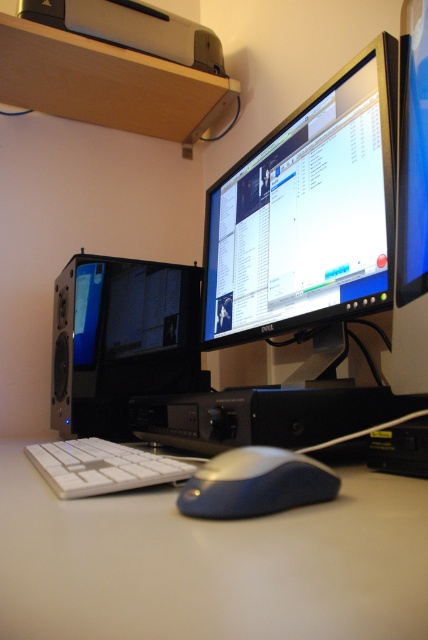
Is white plastic table at lower center below black glossy monitor at center?

Yes.

Can you confirm if white plastic table at lower center is positioned to the left of black glossy monitor at center?

Correct, you'll find white plastic table at lower center to the left of black glossy monitor at center.

Between point (422, 618) and point (380, 52), which one is positioned in front?

Point (422, 618) is more forward.

Where is `white plastic table at lower center`? The image size is (428, 640). white plastic table at lower center is located at coordinates (211, 564).

Is transparent glass computer case at left positioned in front of satin blue mouse at center?

No, it is not.

Consider the image. Can you confirm if transparent glass computer case at left is shorter than satin blue mouse at center?

No.

Is point (119, 435) positioned before point (261, 456)?

No, it is behind (261, 456).

You are a GUI agent. You are given a task and a screenshot of the screen. Output one action in this format:
    pyautogui.click(x=<x>, y=<y>)
    Task: Click on the transparent glass computer case at left
    The image size is (428, 640).
    Given the screenshot: What is the action you would take?
    pyautogui.click(x=121, y=339)

Does black glossy monitor at center have a larger size compared to transparent glass computer case at left?

Correct, black glossy monitor at center is larger in size than transparent glass computer case at left.

Does point (272, 172) come farther from viewer compared to point (71, 260)?

That is False.

Find the location of a particular element. This screenshot has height=640, width=428. black glossy monitor at center is located at coordinates (308, 211).

Locate an element on the screen. black glossy monitor at center is located at coordinates (308, 211).